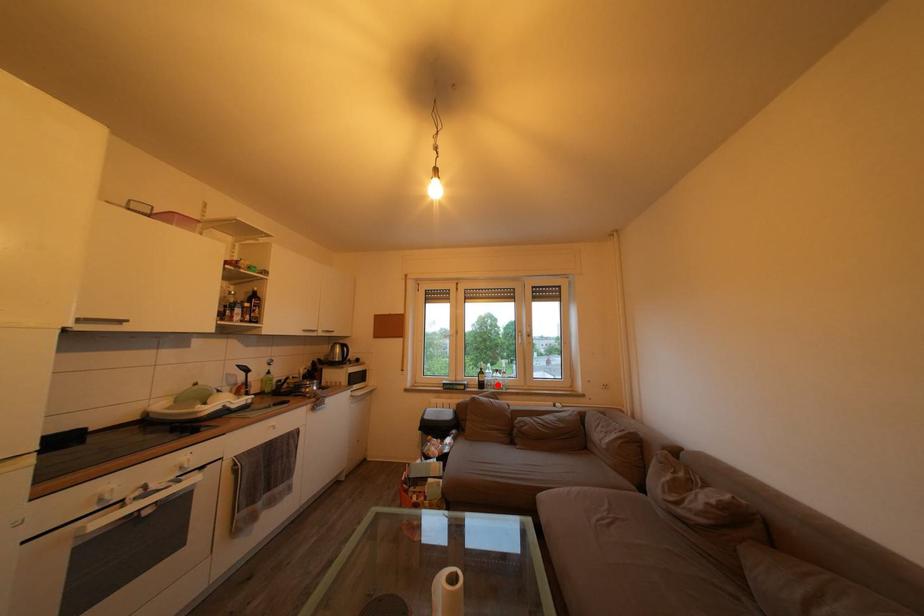
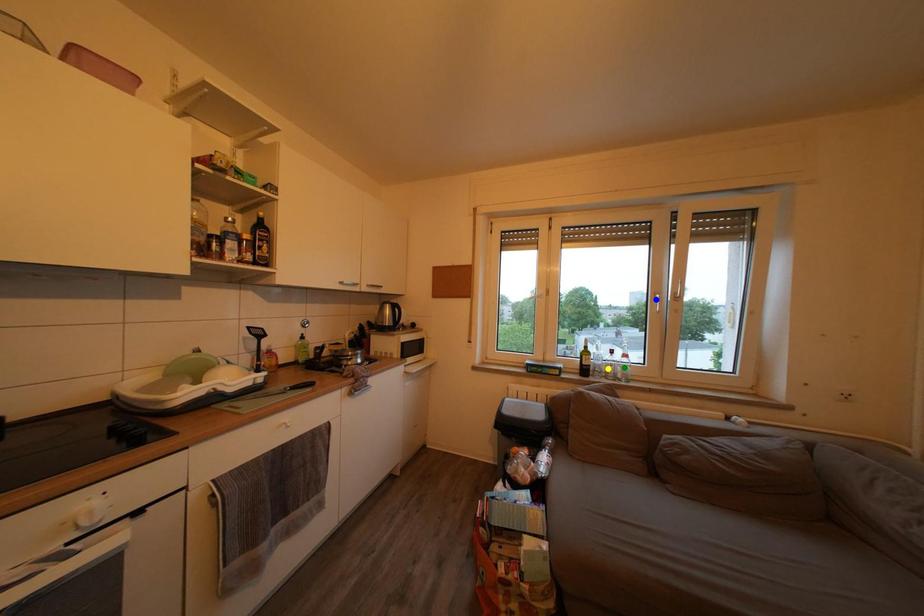
Question: I am providing you with two images of the same scene from different viewpoints. A red point is marked on the first image. You are given multiple points on the second image. Which point in image 2 is actually the same real-world point as the red point in image 1?

Choices:
 (A) blue point
 (B) yellow point
 (C) green point

Answer: (B)